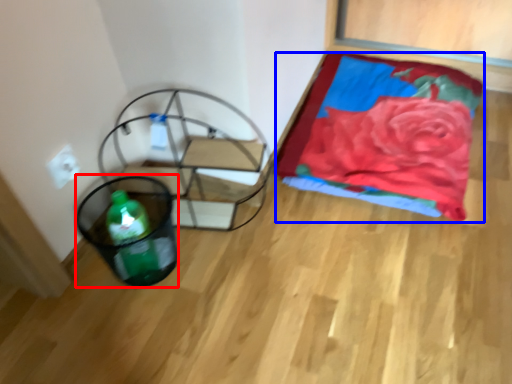
Question: Which point is closer to the camera, basket (highlighted by a red box) or blanket (highlighted by a blue box)?

Choices:
 (A) basket
 (B) blanket

Answer: (A)